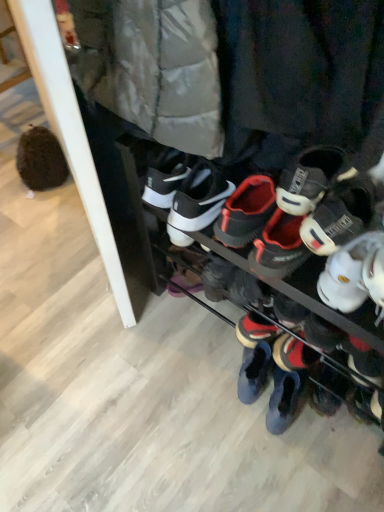
Question: Is black matte sneakers at center, which is counted as the third footwear, starting from the back, not inside black suede sneaker at lower right, which is the first footwear in back-to-front order?

Choices:
 (A) yes
 (B) no

Answer: (A)

Question: From a real-world perspective, is black matte sneakers at center, which is counted as the third footwear, starting from the back, beneath black suede sneaker at lower right, the third footwear from the front?

Choices:
 (A) yes
 (B) no

Answer: (B)

Question: Considering the relative sizes of black matte sneakers at center, the first footwear in the front-to-back sequence, and black suede sneaker at lower right, which is the first footwear in back-to-front order, in the image provided, is black matte sneakers at center, the first footwear in the front-to-back sequence, thinner than black suede sneaker at lower right, which is the first footwear in back-to-front order,?

Choices:
 (A) no
 (B) yes

Answer: (A)

Question: Considering the relative positions of black matte sneakers at center, the first footwear in the front-to-back sequence, and black suede sneaker at lower right, which is the first footwear in back-to-front order, in the image provided, is black matte sneakers at center, the first footwear in the front-to-back sequence, to the right of black suede sneaker at lower right, which is the first footwear in back-to-front order, from the viewer's perspective?

Choices:
 (A) yes
 (B) no

Answer: (B)

Question: Can you confirm if black matte sneakers at center, the first footwear in the front-to-back sequence, is bigger than black suede sneaker at lower right, the third footwear from the front?

Choices:
 (A) yes
 (B) no

Answer: (A)

Question: Is point (372, 412) positioned closer to the camera than point (342, 259)?

Choices:
 (A) farther
 (B) closer

Answer: (A)

Question: In the image, is black suede sneaker at lower right, the third footwear from the front, positioned in front of or behind white matte sneaker at right, acting as the second footwear starting from the back?

Choices:
 (A) behind
 (B) front

Answer: (A)

Question: Is black suede sneaker at lower right, which is the first footwear in back-to-front order, inside or outside of white matte sneaker at right, acting as the second footwear starting from the back?

Choices:
 (A) inside
 (B) outside

Answer: (B)

Question: Is black suede sneaker at lower right, the third footwear from the front, taller or shorter than white matte sneaker at right, acting as the second footwear starting from the back?

Choices:
 (A) tall
 (B) short

Answer: (B)

Question: Does point (357, 406) appear closer or farther from the camera than point (370, 328)?

Choices:
 (A) closer
 (B) farther

Answer: (B)

Question: Looking at their shapes, would you say black suede sneaker at lower right, which is the first footwear in back-to-front order, is wider or thinner than black matte sneakers at center, which is counted as the third footwear, starting from the back?

Choices:
 (A) wide
 (B) thin

Answer: (B)

Question: Is black suede sneaker at lower right, which is the first footwear in back-to-front order, inside or outside of black matte sneakers at center, the first footwear in the front-to-back sequence?

Choices:
 (A) outside
 (B) inside

Answer: (B)

Question: Is black suede sneaker at lower right, the third footwear from the front, taller or shorter than black matte sneakers at center, the first footwear in the front-to-back sequence?

Choices:
 (A) tall
 (B) short

Answer: (B)

Question: Visually, is black matte sneakers at center, which is counted as the third footwear, starting from the back, positioned to the left or to the right of black suede sneaker at lower right, which is the first footwear in back-to-front order?

Choices:
 (A) right
 (B) left

Answer: (B)

Question: Considering the positions of black matte sneakers at center, which is counted as the third footwear, starting from the back, and black suede sneaker at lower right, which is the first footwear in back-to-front order, in the image, is black matte sneakers at center, which is counted as the third footwear, starting from the back, bigger or smaller than black suede sneaker at lower right, which is the first footwear in back-to-front order,?

Choices:
 (A) big
 (B) small

Answer: (A)